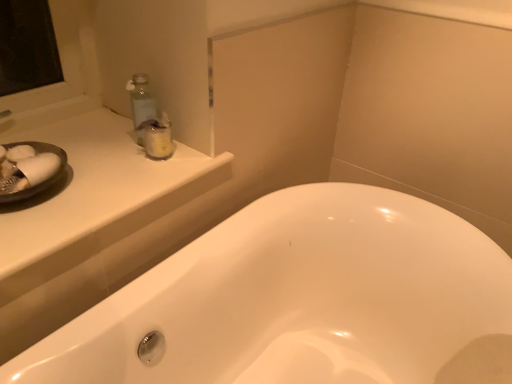
Image resolution: width=512 pixels, height=384 pixels. I want to click on vacant area on top of white glossy counter top at upper left (from a real-world perspective), so click(x=93, y=163).